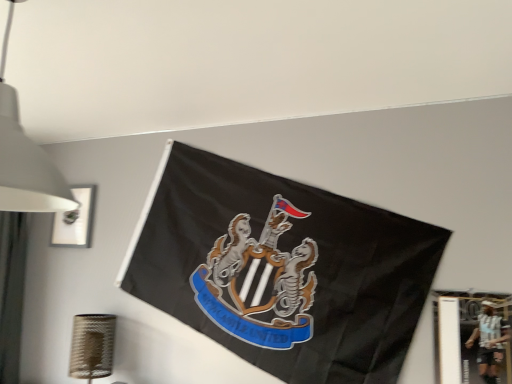
Question: Could you tell me if metallic silver picture frame at lower right, which is counted as the 2th picture frame, starting from the top, is facing matte white picture frame at upper left, placed as the 1th picture frame when sorted from left to right?

Choices:
 (A) no
 (B) yes

Answer: (A)

Question: Is metallic silver picture frame at lower right, arranged as the second picture frame when viewed from the left, positioned beyond the bounds of matte white picture frame at upper left, which appears as the second picture frame when ordered from the bottom?

Choices:
 (A) yes
 (B) no

Answer: (A)

Question: Can you confirm if metallic silver picture frame at lower right, positioned as the first picture frame in bottom-to-top order, is positioned to the right of matte white picture frame at upper left, the 1th picture frame positioned from the top?

Choices:
 (A) yes
 (B) no

Answer: (A)

Question: Considering the relative sizes of metallic silver picture frame at lower right, which is the 1th picture frame from front to back, and matte white picture frame at upper left, the 1th picture frame positioned from the top, in the image provided, is metallic silver picture frame at lower right, which is the 1th picture frame from front to back, smaller than matte white picture frame at upper left, the 1th picture frame positioned from the top,?

Choices:
 (A) yes
 (B) no

Answer: (A)

Question: Is metallic silver picture frame at lower right, which is counted as the 2th picture frame, starting from the top, taller than matte white picture frame at upper left, which appears as the second picture frame when ordered from the bottom?

Choices:
 (A) yes
 (B) no

Answer: (A)

Question: Is metallic silver picture frame at lower right, arranged as the second picture frame when viewed from the left, looking in the opposite direction of matte white picture frame at upper left, placed as the 1th picture frame when sorted from left to right?

Choices:
 (A) yes
 (B) no

Answer: (B)

Question: Is white matte lampshade at upper left touching metallic silver picture frame at lower right, which is the 1th picture frame from front to back?

Choices:
 (A) no
 (B) yes

Answer: (A)

Question: Does white matte lampshade at upper left lie in front of metallic silver picture frame at lower right, positioned as the 2th picture frame in back-to-front order?

Choices:
 (A) yes
 (B) no

Answer: (A)

Question: Is white matte lampshade at upper left to the right of metallic silver picture frame at lower right, positioned as the first picture frame in bottom-to-top order, from the viewer's perspective?

Choices:
 (A) no
 (B) yes

Answer: (A)

Question: Considering the relative positions of white matte lampshade at upper left and metallic silver picture frame at lower right, which is counted as the 2th picture frame, starting from the top, in the image provided, is white matte lampshade at upper left to the left of metallic silver picture frame at lower right, which is counted as the 2th picture frame, starting from the top, from the viewer's perspective?

Choices:
 (A) no
 (B) yes

Answer: (B)

Question: Could you tell me if white matte lampshade at upper left is facing metallic silver picture frame at lower right, which is counted as the 2th picture frame, starting from the top?

Choices:
 (A) yes
 (B) no

Answer: (B)

Question: Are white matte lampshade at upper left and metallic silver picture frame at lower right, positioned as the 2th picture frame in back-to-front order, located far from each other?

Choices:
 (A) no
 (B) yes

Answer: (B)

Question: From a real-world perspective, is metallic silver picture frame at lower right, arranged as the second picture frame when viewed from the left, on top of white matte lampshade at upper left?

Choices:
 (A) no
 (B) yes

Answer: (A)